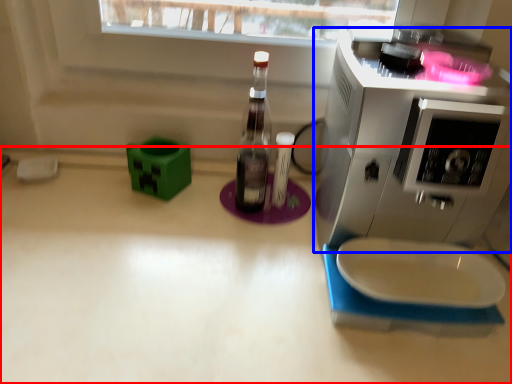
Question: Which of the following is the closest to the observer, countertop (highlighted by a red box) or home appliance (highlighted by a blue box)?

Choices:
 (A) countertop
 (B) home appliance

Answer: (B)